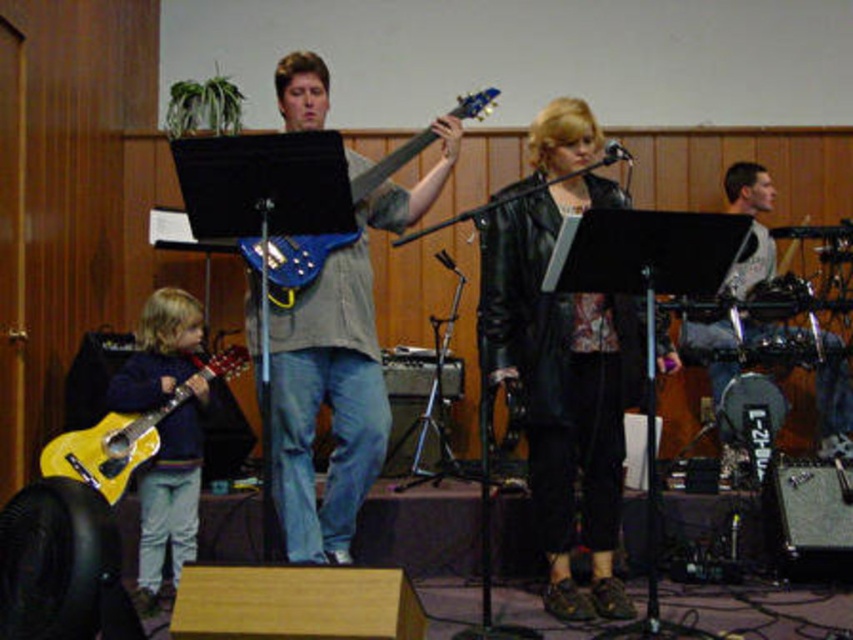
Question: Which point is closer to the camera taking this photo?

Choices:
 (A) click(x=605, y=410)
 (B) click(x=294, y=122)
 (C) click(x=120, y=468)

Answer: (B)

Question: Is gray textured shirt at right closer to the viewer compared to yellow matte guitar at lower left?

Choices:
 (A) yes
 (B) no

Answer: (B)

Question: Among these objects, which one is farthest from the camera?

Choices:
 (A) black leather jacket at center
 (B) shiny blue guitar at center
 (C) gray textured shirt at right

Answer: (C)

Question: Which point is closer to the camera?

Choices:
 (A) (727, 276)
 (B) (376, 170)
 (C) (358, 358)

Answer: (A)

Question: Considering the relative positions of black leather jacket at center and gray textured shirt at right in the image provided, where is black leather jacket at center located with respect to gray textured shirt at right?

Choices:
 (A) right
 (B) left

Answer: (B)

Question: Is gray textured shirt at right above yellow matte guitar at lower left?

Choices:
 (A) no
 (B) yes

Answer: (B)